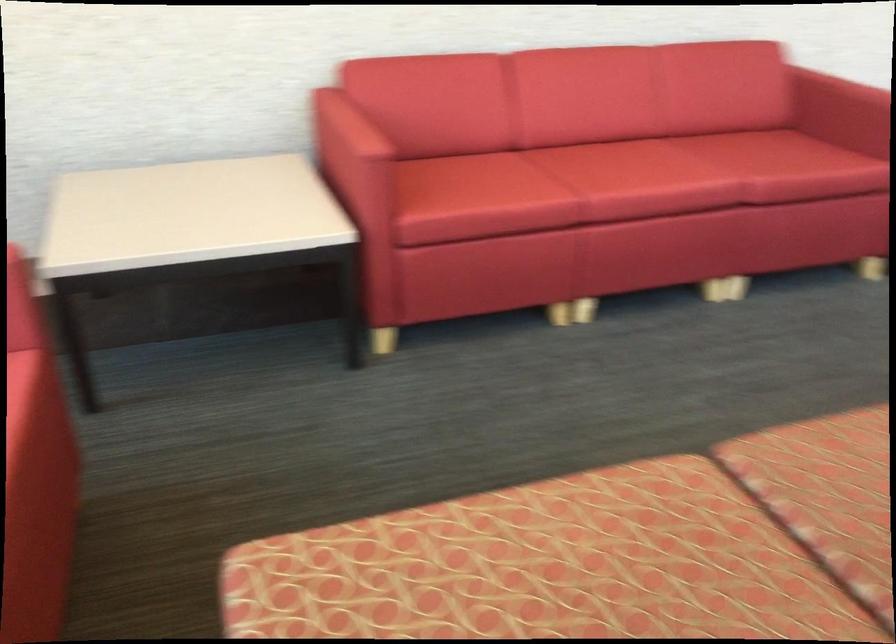
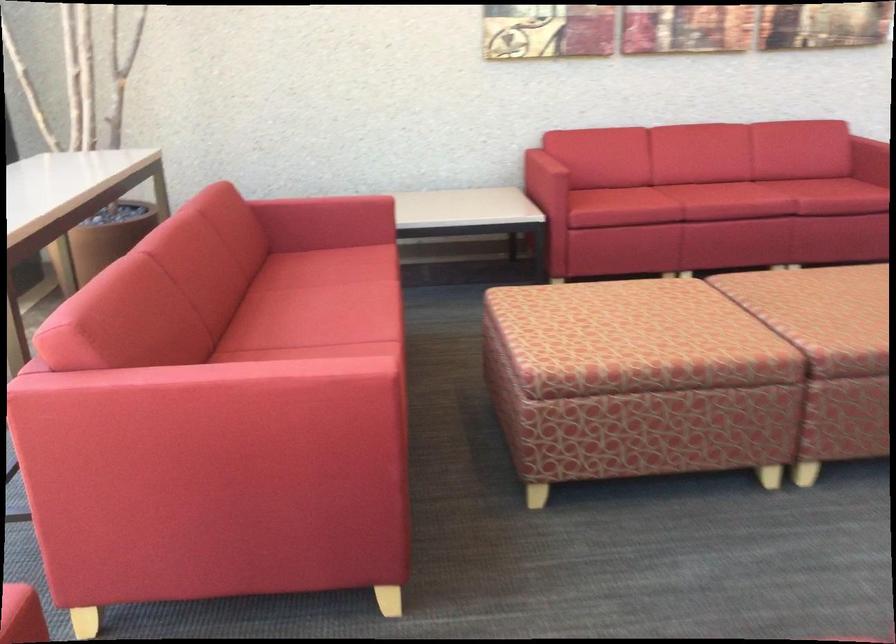
Where in the second image is the point corresponding to point (359, 147) from the first image?

(545, 166)